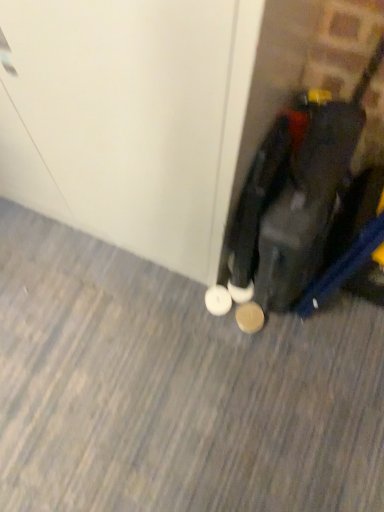
Question: From the image's perspective, is matte black suitcase at lower right located above or below white glossy door at center?

Choices:
 (A) below
 (B) above

Answer: (A)

Question: Considering the positions of matte black suitcase at lower right and white glossy door at center in the image, is matte black suitcase at lower right wider or thinner than white glossy door at center?

Choices:
 (A) wide
 (B) thin

Answer: (B)

Question: Which of these objects is positioned farthest from the white glossy door at center?

Choices:
 (A) matte black suitcase at lower right
 (B) brown suede shoe at lower right

Answer: (B)

Question: Which object is the closest to the brown suede shoe at lower right?

Choices:
 (A) white glossy door at center
 (B) matte black suitcase at lower right

Answer: (B)